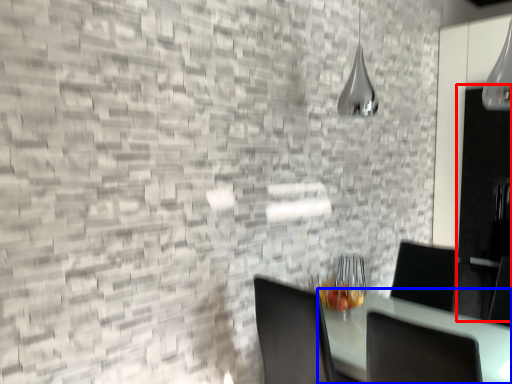
Question: Among these objects, which one is farthest to the camera, glass door (highlighted by a red box) or table (highlighted by a blue box)?

Choices:
 (A) glass door
 (B) table

Answer: (A)